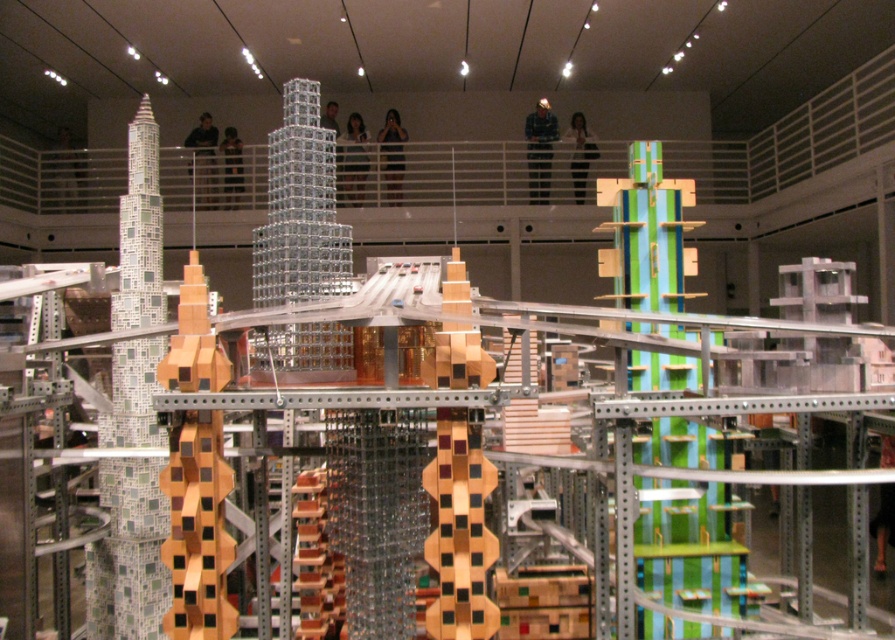
Question: Can you confirm if translucent glass tower at center is thinner than wooden block tower at center-left?

Choices:
 (A) no
 (B) yes

Answer: (A)

Question: Among these points, which one is farthest from the camera?

Choices:
 (A) (192, 321)
 (B) (308, 355)

Answer: (B)

Question: Which object is positioned closest to the wooden block tower at center-left?

Choices:
 (A) green mosaic tower at left
 (B) translucent glass tower at center

Answer: (B)

Question: Does green mosaic tower at left have a smaller size compared to wooden block tower at center-left?

Choices:
 (A) no
 (B) yes

Answer: (A)

Question: Which of the following is the farthest from the observer?

Choices:
 (A) wooden block tower at center-left
 (B) translucent glass tower at center

Answer: (B)

Question: Does translucent glass tower at center lie behind wooden block tower at center-left?

Choices:
 (A) yes
 (B) no

Answer: (A)